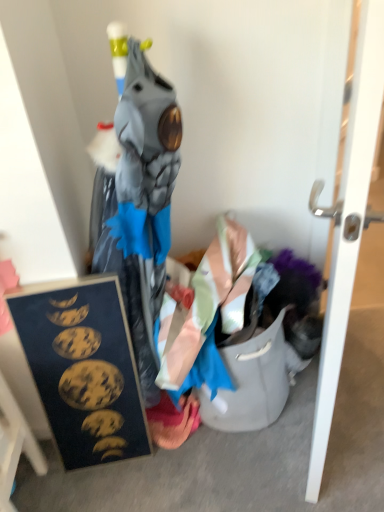
Question: From their relative heights in the image, would you say white glossy door at right is taller or shorter than pink fabric at lower center?

Choices:
 (A) short
 (B) tall

Answer: (B)

Question: Is point (342, 318) positioned closer to the camera than point (183, 440)?

Choices:
 (A) farther
 (B) closer

Answer: (B)

Question: Which object is positioned farthest from the pink fabric at lower center?

Choices:
 (A) white glossy door at right
 (B) wooden frame at lower left

Answer: (A)

Question: Estimate the real-world distances between objects in this image. Which object is closer to the white glossy door at right?

Choices:
 (A) pink fabric at lower center
 (B) wooden frame at lower left

Answer: (A)